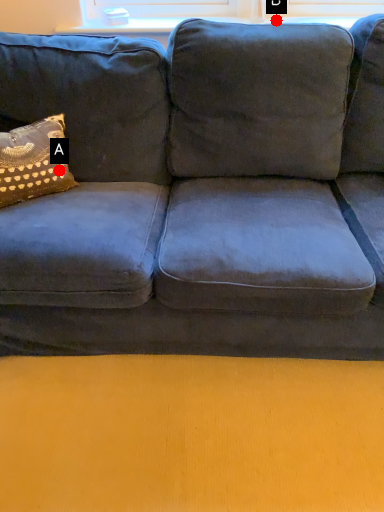
Question: Two points are circled on the image, labeled by A and B beside each circle. Among these points, which one is nearest to the camera?

Choices:
 (A) A is closer
 (B) B is closer

Answer: (A)